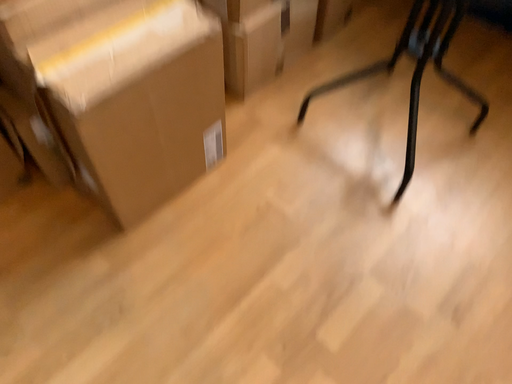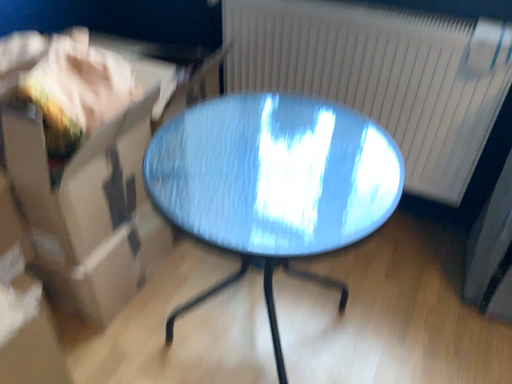
Question: Which way did the camera rotate in the video?

Choices:
 (A) rotated right
 (B) rotated left

Answer: (A)